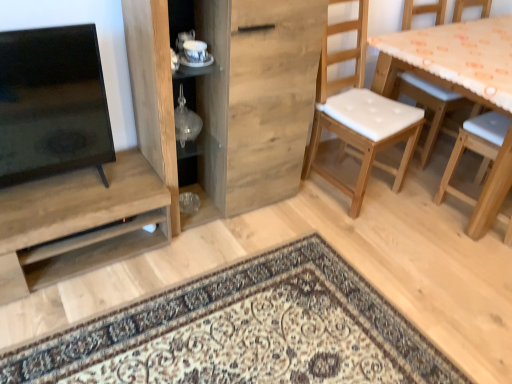
At what (x,y) coordinates should I click in order to perform the action: click on matte wood shelf at left, placed as the 1th shelf when sorted from bottom to top. Please return your answer as a coordinate pair (x, y). The width and height of the screenshot is (512, 384). Looking at the image, I should click on (78, 222).

At what (x,y) coordinates should I click in order to perform the action: click on transparent glass vase at center, which is the 2th shelf from bottom to top. Please return your answer as a coordinate pair (x, y). The height and width of the screenshot is (384, 512). Looking at the image, I should click on (186, 119).

In order to click on matte wood shelf at left, arranged as the 2th shelf when viewed from the top in this screenshot , I will do `click(78, 222)`.

Is transparent glass vase at center, which is the 2th shelf from left to right, next to wooden table with orange patterned cloth at right and touching it?

No, transparent glass vase at center, which is the 2th shelf from left to right, is not beside wooden table with orange patterned cloth at right.

Which is more to the left, transparent glass vase at center, which is the 2th shelf from bottom to top, or wooden table with orange patterned cloth at right?

From the viewer's perspective, transparent glass vase at center, which is the 2th shelf from bottom to top, appears more on the left side.

Where is `shelf above the wooden table with orange patterned cloth at right (from a real-world perspective)`? This screenshot has height=384, width=512. shelf above the wooden table with orange patterned cloth at right (from a real-world perspective) is located at coordinates (186, 119).

Does transparent glass vase at center, acting as the first shelf starting from the top, have a smaller size compared to wooden table with orange patterned cloth at right?

Correct, transparent glass vase at center, acting as the first shelf starting from the top, occupies less space than wooden table with orange patterned cloth at right.

Where is `shelf above the matte wood shelf at left, the 2th shelf from the right (from a real-world perspective)`? This screenshot has height=384, width=512. shelf above the matte wood shelf at left, the 2th shelf from the right (from a real-world perspective) is located at coordinates (186, 119).

How different are the orientations of matte wood shelf at left, the 2th shelf from the right, and transparent glass vase at center, which appears as the first shelf when viewed from the right, in degrees?

The facing directions of matte wood shelf at left, the 2th shelf from the right, and transparent glass vase at center, which appears as the first shelf when viewed from the right, are 0.826 degrees apart.

In the image, is matte wood shelf at left, acting as the 1th shelf starting from the left, positioned in front of or behind transparent glass vase at center, which is the 2th shelf from left to right?

Visually, matte wood shelf at left, acting as the 1th shelf starting from the left, is located in front of transparent glass vase at center, which is the 2th shelf from left to right.

Is wooden table with orange patterned cloth at right wider than wooden cabinet at center?

Yes, wooden table with orange patterned cloth at right is wider than wooden cabinet at center.

Considering the positions of point (368, 41) and point (137, 64), is point (368, 41) closer or farther from the camera than point (137, 64)?

Clearly, point (368, 41) is more distant from the camera than point (137, 64).

Is wooden table with orange patterned cloth at right not inside wooden cabinet at center?

Yes, wooden table with orange patterned cloth at right is located beyond the bounds of wooden cabinet at center.

Which object is positioned more to the left, white padded wood chair at right or matte wood shelf at left, placed as the 1th shelf when sorted from bottom to top?

matte wood shelf at left, placed as the 1th shelf when sorted from bottom to top.

Which object is closer to the camera, white padded wood chair at right or matte wood shelf at left, acting as the 1th shelf starting from the left?

matte wood shelf at left, acting as the 1th shelf starting from the left, is in front.

Is white padded wood chair at right thinner than matte wood shelf at left, acting as the 1th shelf starting from the left?

No.

Considering the positions of objects wooden table with orange patterned cloth at right and transparent glass vase at center, which is the 2th shelf from bottom to top, in the image provided, who is in front, wooden table with orange patterned cloth at right or transparent glass vase at center, which is the 2th shelf from bottom to top,?

wooden table with orange patterned cloth at right is more forward.

In terms of size, does wooden table with orange patterned cloth at right appear bigger or smaller than transparent glass vase at center, which is the 2th shelf from left to right?

Clearly, wooden table with orange patterned cloth at right is larger in size than transparent glass vase at center, which is the 2th shelf from left to right.

What's the angular difference between wooden table with orange patterned cloth at right and transparent glass vase at center, acting as the first shelf starting from the top,'s facing directions?

The facing directions of wooden table with orange patterned cloth at right and transparent glass vase at center, acting as the first shelf starting from the top, are 178 degrees apart.

Does white padded wood chair at right have a greater width compared to wooden cabinet at center?

Correct, the width of white padded wood chair at right exceeds that of wooden cabinet at center.

From the image's perspective, is white padded wood chair at right above or below wooden cabinet at center?

white padded wood chair at right is situated higher than wooden cabinet at center in the image.

From a real-world perspective, between white padded wood chair at right and wooden cabinet at center, who is vertically lower?

white padded wood chair at right, from a real-world perspective.

In the image, is wooden table with orange patterned cloth at right positioned in front of or behind white padded wood chair at right?

wooden table with orange patterned cloth at right is positioned closer to the viewer than white padded wood chair at right.

Which of these two, wooden table with orange patterned cloth at right or white padded wood chair at right, stands shorter?

wooden table with orange patterned cloth at right.

Is wooden table with orange patterned cloth at right oriented away from white padded wood chair at right?

wooden table with orange patterned cloth at right does not have its back to white padded wood chair at right.

In order to click on chair above the wooden table with orange patterned cloth at right (from the image's perspective) in this screenshot , I will do `click(359, 114)`.

Where is `shelf that appears above the wooden table with orange patterned cloth at right (from a real-world perspective)`? This screenshot has height=384, width=512. shelf that appears above the wooden table with orange patterned cloth at right (from a real-world perspective) is located at coordinates (186, 119).

Locate an element on the screen. shelf on the left side of transparent glass vase at center, which is the 2th shelf from bottom to top is located at coordinates (78, 222).

Which object lies further to the anchor point matte wood shelf at left, acting as the 1th shelf starting from the left, wooden table with orange patterned cloth at right or transparent glass vase at center, which is the 2th shelf from bottom to top?

wooden table with orange patterned cloth at right is positioned further to the anchor matte wood shelf at left, acting as the 1th shelf starting from the left.

Considering their positions, is wooden table with orange patterned cloth at right positioned further to wooden cabinet at center than transparent glass vase at center, which is the 2th shelf from bottom to top?

wooden table with orange patterned cloth at right.

From the picture: Based on their spatial positions, is matte wood shelf at left, arranged as the 2th shelf when viewed from the top, or wooden table with orange patterned cloth at right closer to transparent glass vase at center, which appears as the first shelf when viewed from the right?

matte wood shelf at left, arranged as the 2th shelf when viewed from the top, is closer to transparent glass vase at center, which appears as the first shelf when viewed from the right.

Based on their spatial positions, is transparent glass vase at center, acting as the first shelf starting from the top, or white padded wood chair at right closer to wooden table with orange patterned cloth at right?

white padded wood chair at right is positioned closer to the anchor wooden table with orange patterned cloth at right.

From the image, which object appears to be nearer to transparent glass vase at center, acting as the first shelf starting from the top, matte wood shelf at left, acting as the 1th shelf starting from the left, or white padded wood chair at right?

matte wood shelf at left, acting as the 1th shelf starting from the left, is closer to transparent glass vase at center, acting as the first shelf starting from the top.

Looking at this image, based on their spatial positions, is white padded wood chair at right or transparent glass vase at center, which is the 2th shelf from left to right, further from wooden cabinet at center?

white padded wood chair at right is further to wooden cabinet at center.

Looking at the image, which one is located further to transparent glass vase at center, which is the 2th shelf from bottom to top, wooden table with orange patterned cloth at right or white padded wood chair at right?

wooden table with orange patterned cloth at right.

Which object lies nearer to the anchor point matte wood shelf at left, placed as the 1th shelf when sorted from bottom to top, wooden table with orange patterned cloth at right or wooden cabinet at center?

wooden cabinet at center is closer to matte wood shelf at left, placed as the 1th shelf when sorted from bottom to top.

Find the location of a particular element. The image size is (512, 384). shelf between matte wood shelf at left, acting as the 1th shelf starting from the left, and white padded wood chair at right from left to right is located at coordinates (186, 119).

Identify the location of cabinetry between matte wood shelf at left, arranged as the 2th shelf when viewed from the top, and wooden table with orange patterned cloth at right from left to right. The height and width of the screenshot is (384, 512). (255, 101).

This screenshot has height=384, width=512. Identify the location of chair between wooden cabinet at center and wooden table with orange patterned cloth at right. (359, 114).

The image size is (512, 384). I want to click on cabinetry between transparent glass vase at center, acting as the first shelf starting from the top, and white padded wood chair at right, so 255,101.